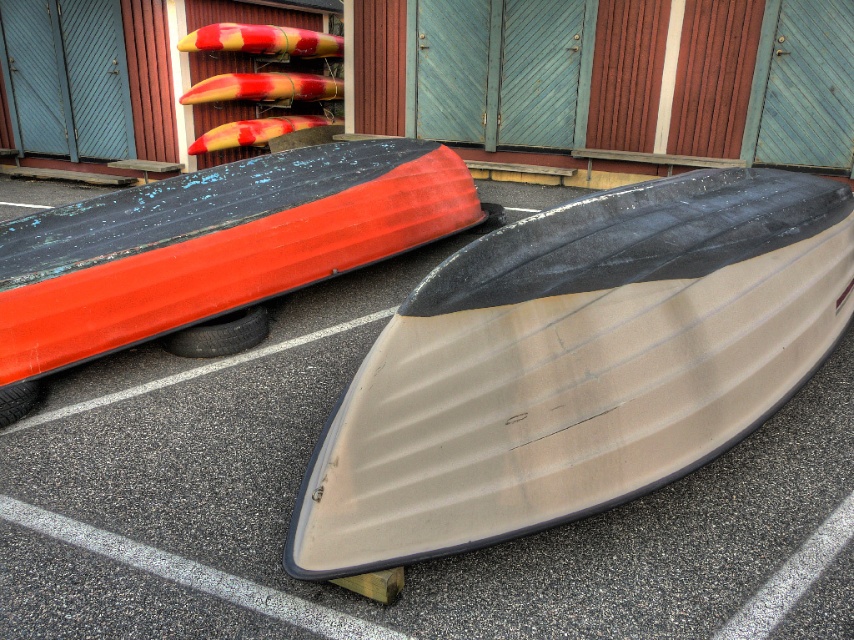
Question: Is the position of smooth beige boat at center less distant than that of red and yellow striped surfboard at upper center?

Choices:
 (A) no
 (B) yes

Answer: (B)

Question: Does smooth beige boat at center have a larger size compared to red and yellow striped surfboard at upper center?

Choices:
 (A) yes
 (B) no

Answer: (B)

Question: Estimate the real-world distances between objects in this image. Which object is farther from the red and yellow striped surfboard at upper center?

Choices:
 (A) red-yellow foam surfboard at center
 (B) smooth beige boat at center
 (C) red-yellow striped surfboard at center

Answer: (B)

Question: Which point appears closest to the camera in this image?

Choices:
 (A) (249, 80)
 (B) (349, 296)
 (C) (284, 120)
 (D) (278, 29)

Answer: (B)

Question: Is smooth beige boat at center bigger than red and yellow striped surfboard at upper center?

Choices:
 (A) yes
 (B) no

Answer: (B)

Question: Which object appears closest to the camera in this image?

Choices:
 (A) red-yellow foam surfboard at center
 (B) red-yellow striped surfboard at center
 (C) smooth beige boat at center

Answer: (C)